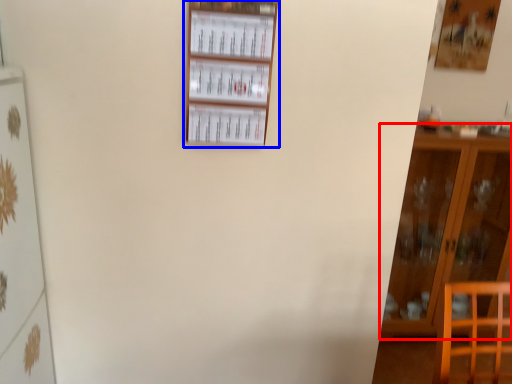
Question: Which point is further to the camera, furniture (highlighted by a red box) or shelf (highlighted by a blue box)?

Choices:
 (A) furniture
 (B) shelf

Answer: (A)